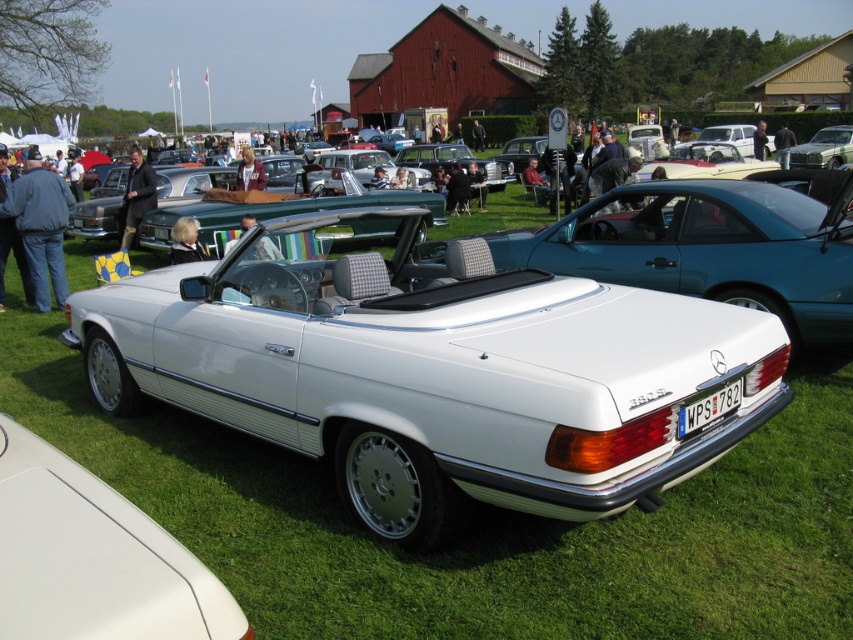
Question: Which of the following is the farthest from the observer?

Choices:
 (A) (795, 152)
 (B) (195, 241)
 (C) (782, 429)

Answer: (A)

Question: Can you confirm if blonde hair at center is thinner than light brown leather jacket at center?

Choices:
 (A) no
 (B) yes

Answer: (B)

Question: Observing the image, what is the correct spatial positioning of white leather convertible at center in reference to dark blue jeans at center?

Choices:
 (A) left
 (B) right

Answer: (A)

Question: Which is farther from the metallic silver convertible at center?

Choices:
 (A) white leather convertible at center
 (B) gray jacket at left
 (C) white plastic license plate at lower center
 (D) blonde hair at center

Answer: (B)

Question: Is green grass at center to the right of dark brown leather jacket at left from the viewer's perspective?

Choices:
 (A) no
 (B) yes

Answer: (B)

Question: Estimate the real-world distances between objects in this image. Which object is closer to the white matte convertible at center?

Choices:
 (A) green grass at center
 (B) light brown leather jacket at center

Answer: (B)